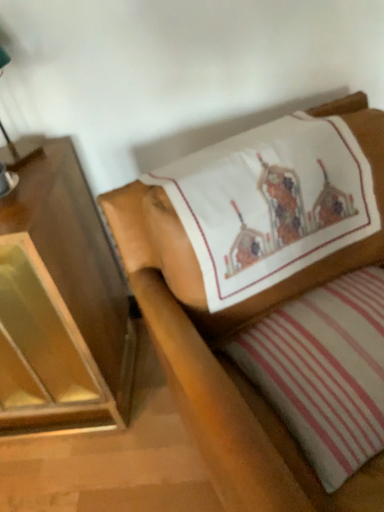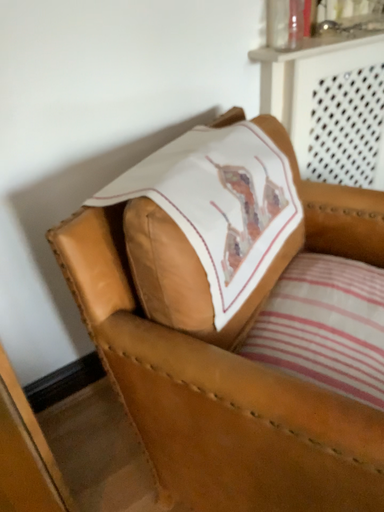
Question: How did the camera likely rotate when shooting the video?

Choices:
 (A) rotated upward
 (B) rotated downward

Answer: (A)